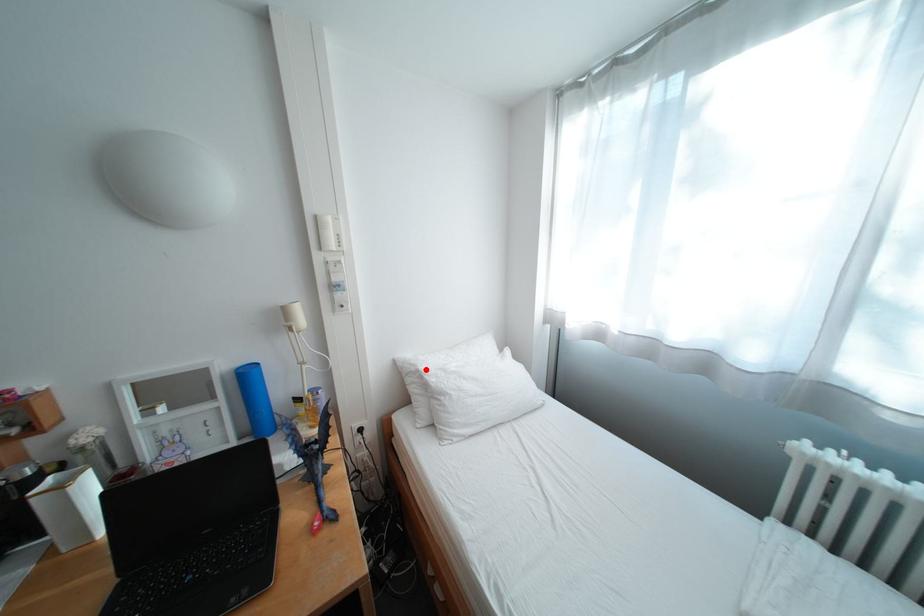
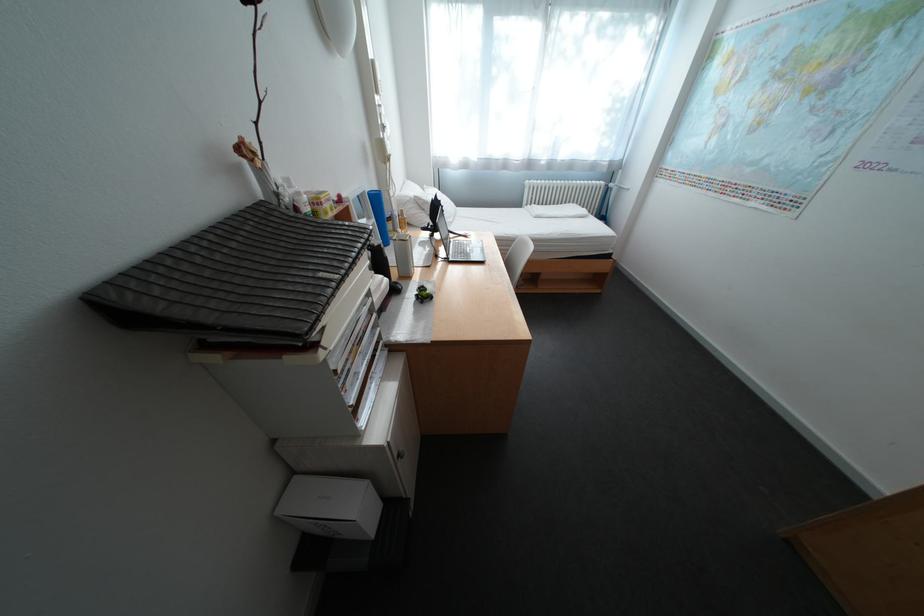
Find the pixel in the second image that matches the highlighted location in the first image.

(420, 200)